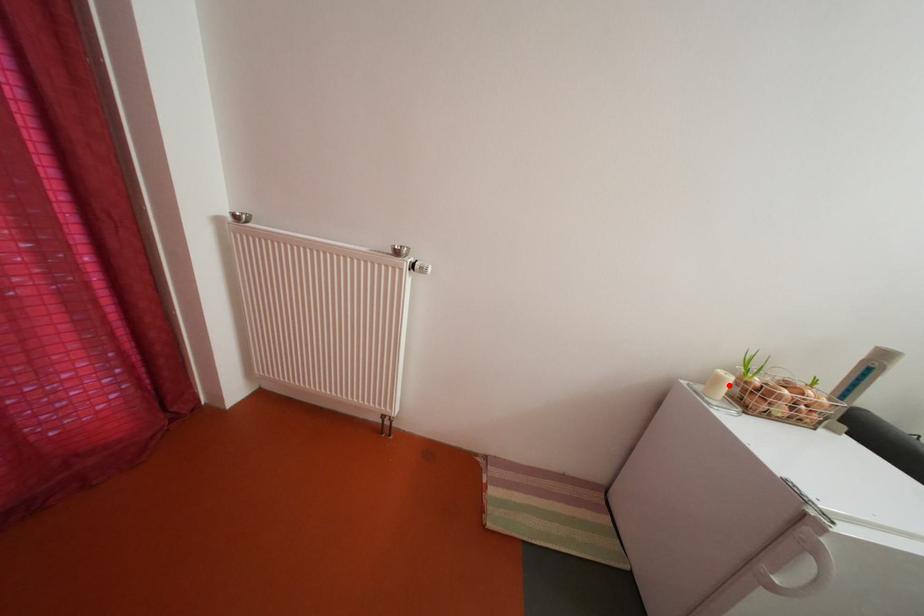
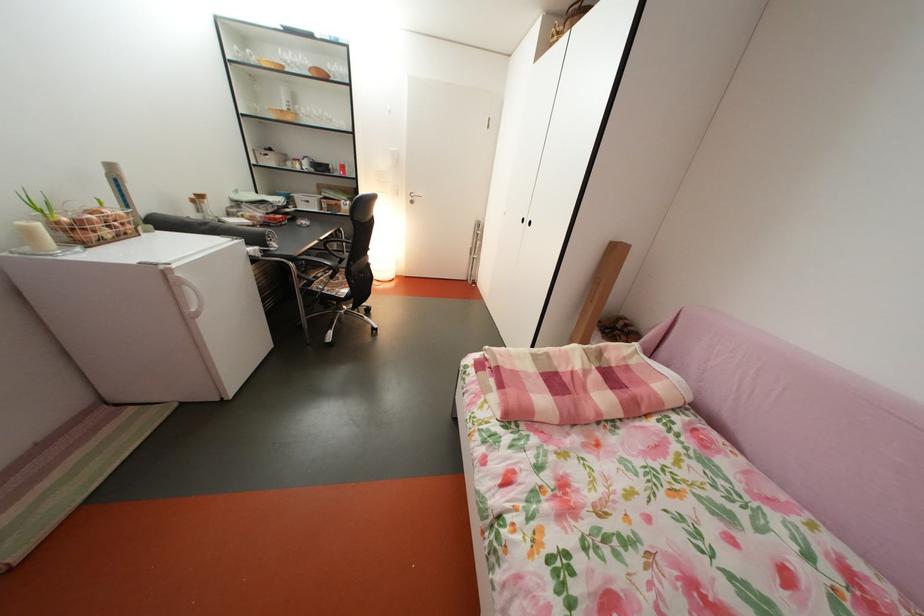
Locate, in the second image, the point that corresponds to the highlighted location in the first image.

(41, 238)